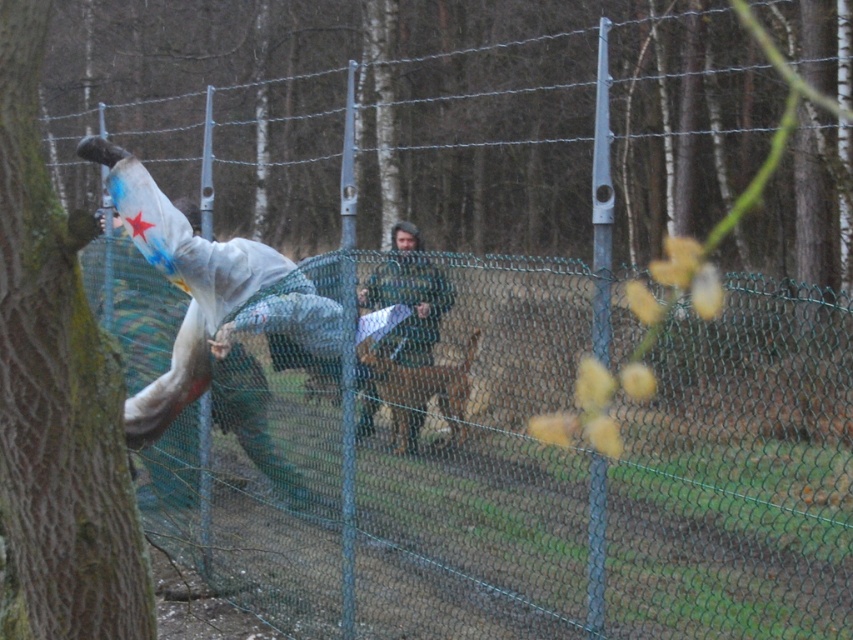
You are a hiker who needs to cross the chain link fence in the foreground. You see a green mossy bark tree at left and a camouflage fabric jacket at center. Which object is closer to the left side of the fence?

The green mossy bark tree at left is closer to the left side of the fence because it is positioned to the left of the camouflage fabric jacket at center.

You are standing at the center of the image and want to move towards the green mossy bark tree at left. Which direction should you move?

You should move to the left to reach the green mossy bark tree at left since it is positioned at point (56, 394) which is on the left side of the image.

You are a hiker who needs to cross the chain link fence in the foreground to reach the forest behind. The green mossy bark tree at left and the camouflage fabric jacket at center are in your path. Which object is higher up in your view when looking towards the forest?

The green mossy bark tree at left is higher up in your view than the camouflage fabric jacket at center when looking towards the forest.